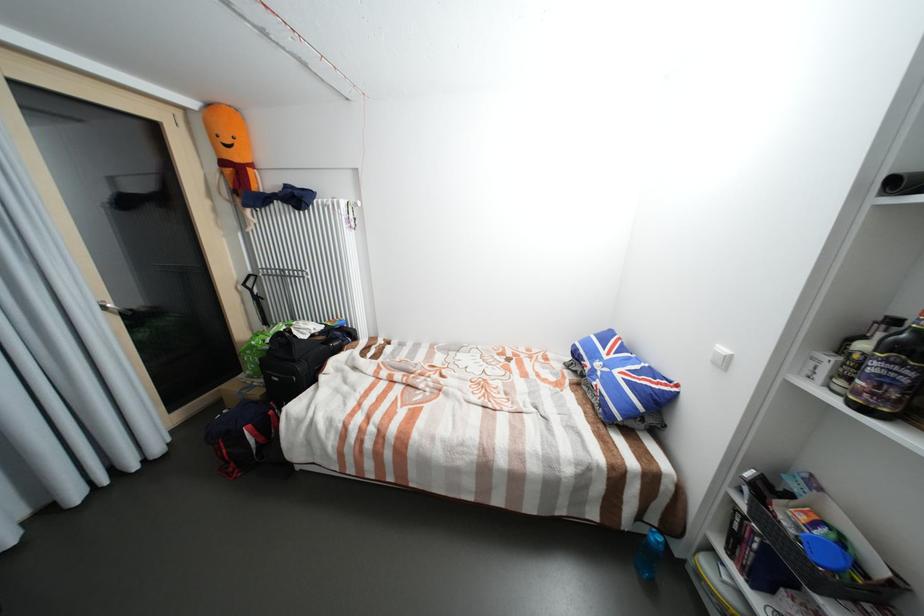
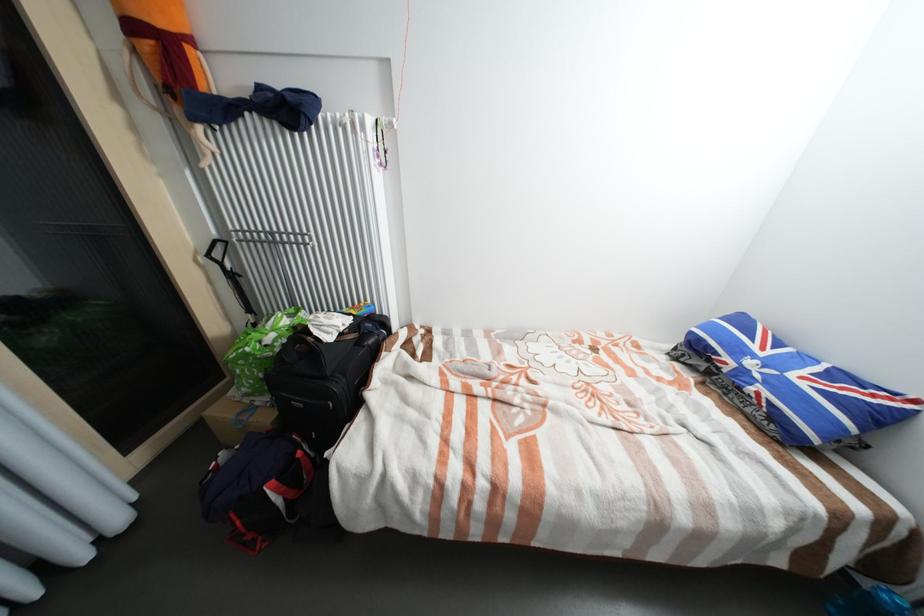
The point at (343,339) is marked in the first image. Where is the corresponding point in the second image?

(377, 334)